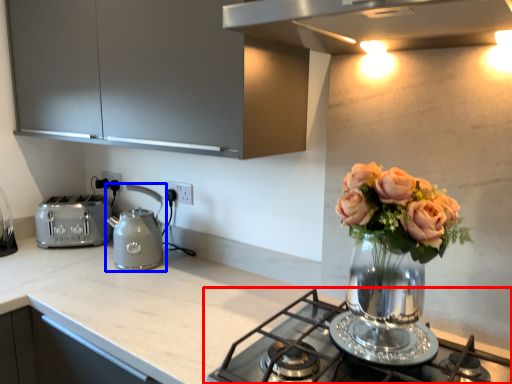
Question: Among these objects, which one is farthest to the camera, gas stove (highlighted by a red box) or kettle (highlighted by a blue box)?

Choices:
 (A) gas stove
 (B) kettle

Answer: (B)